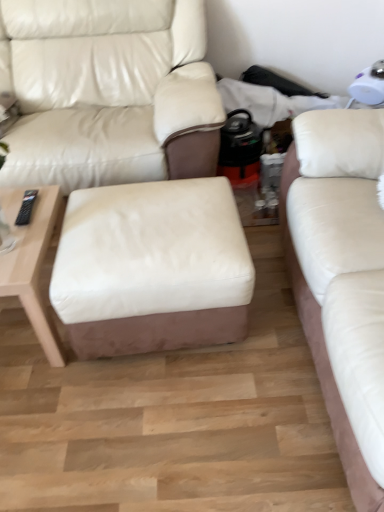
You are a GUI agent. You are given a task and a screenshot of the screen. Output one action in this format:
    pyautogui.click(x=<x>, y=<y>)
    Task: Click on the vacant area that lies in front of light wood/woodentable at left
    
    Given the screenshot: What is the action you would take?
    pyautogui.click(x=56, y=407)